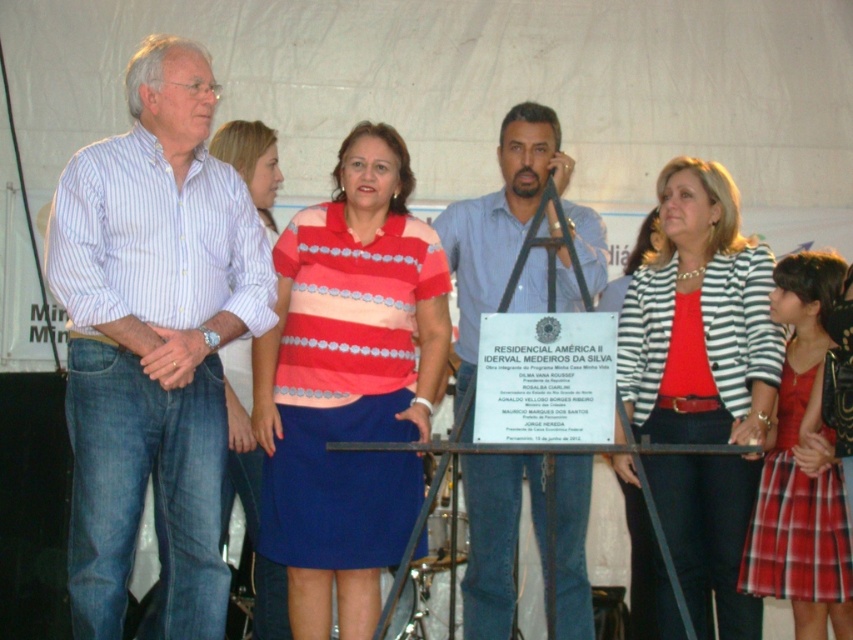
Can you confirm if blue shirt at center is positioned to the left of striped fabric dress at center?

No, blue shirt at center is not to the left of striped fabric dress at center.

This screenshot has width=853, height=640. Describe the element at coordinates (498, 221) in the screenshot. I see `blue shirt at center` at that location.

In order to click on blue shirt at center in this screenshot , I will do `click(498, 221)`.

Which is more to the right, light blue striped shirt at left or striped cotton jacket at center?

striped cotton jacket at center is more to the right.

Image resolution: width=853 pixels, height=640 pixels. Describe the element at coordinates (154, 339) in the screenshot. I see `light blue striped shirt at left` at that location.

At what (x,y) coordinates should I click in order to perform the action: click on light blue striped shirt at left. Please return your answer as a coordinate pair (x, y). The width and height of the screenshot is (853, 640). Looking at the image, I should click on (154, 339).

Between blue shirt at center and blue cotton shirt at center, which one appears on the left side from the viewer's perspective?

blue shirt at center is more to the left.

At what (x,y) coordinates should I click in order to perform the action: click on blue shirt at center. Please return your answer as a coordinate pair (x, y). Image resolution: width=853 pixels, height=640 pixels. Looking at the image, I should click on (498, 221).